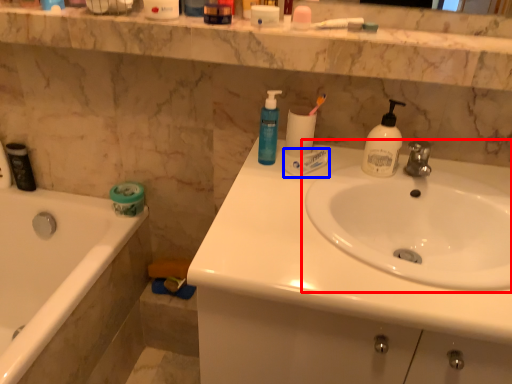
Question: Which point is closer to the camera, sink (highlighted by a red box) or toothpaste (highlighted by a blue box)?

Choices:
 (A) sink
 (B) toothpaste

Answer: (A)